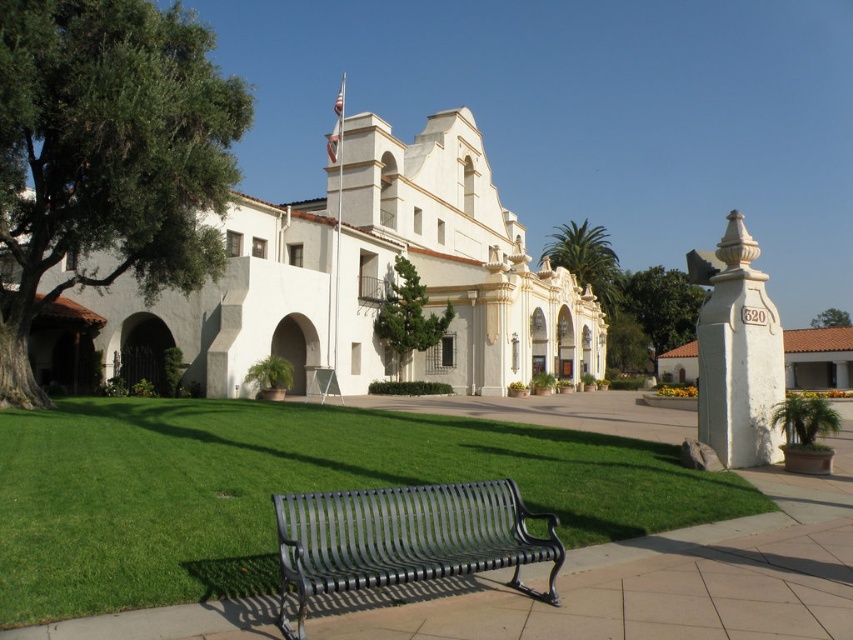
Consider the image. You are planning to place a new decorative statue that is 2 meters wide on the green grass at center. Considering the space available, will the white stone column at right interfere with the placement?

The green grass at center might be wider than the white stone column at right, so there is a possibility that the statue can be placed without interference. However, the exact width comparison is uncertain based on the provided information.

You are standing at the point marked by the coordinates point (107, 156). Looking towards the historic building, which direction should you walk to reach the black metal bench on the walkway?

The point (107, 156) corresponds to the green leafy tree at left. To reach the black metal bench on the walkway, you should walk towards the right, as the bench is located on the walkway to the right of the building.

You are standing on the paved walkway and want to find shade. Which tree, the green leafy tree at left or the green leafy tree at center, provides more shade coverage?

The green leafy tree at center provides more shade coverage because it is taller than the green leafy tree at left.